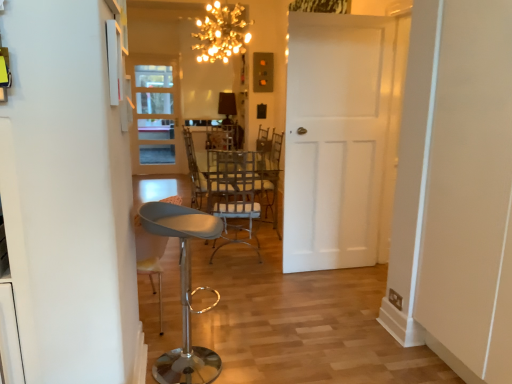
Question: Would you consider metallic gray stool at lower left to be distant from metallic silver chair at center?

Choices:
 (A) no
 (B) yes

Answer: (B)

Question: Is metallic gray stool at lower left outside metallic silver chair at center?

Choices:
 (A) no
 (B) yes

Answer: (B)

Question: Does metallic gray stool at lower left have a larger size compared to metallic silver chair at center?

Choices:
 (A) yes
 (B) no

Answer: (B)

Question: Does metallic gray stool at lower left have a greater height compared to metallic silver chair at center?

Choices:
 (A) no
 (B) yes

Answer: (A)

Question: From the image's perspective, is metallic gray stool at lower left below metallic silver chair at center?

Choices:
 (A) no
 (B) yes

Answer: (B)

Question: Is metallic silver chair at center at the back of metallic gray stool at lower left?

Choices:
 (A) yes
 (B) no

Answer: (B)

Question: Are metallic gray stool at lower left and white matte door at center, placed as the first door when sorted from right to left, making contact?

Choices:
 (A) no
 (B) yes

Answer: (A)

Question: Is metallic gray stool at lower left outside of white matte door at center, acting as the second door starting from the left?

Choices:
 (A) no
 (B) yes

Answer: (B)

Question: From a real-world perspective, is metallic gray stool at lower left positioned under white matte door at center, which appears as the 1th door when viewed from the front, based on gravity?

Choices:
 (A) yes
 (B) no

Answer: (A)

Question: Does metallic gray stool at lower left have a greater height compared to white matte door at center, the 2th door viewed from the back?

Choices:
 (A) yes
 (B) no

Answer: (B)

Question: Considering the relative sizes of metallic gray stool at lower left and white matte door at center, which appears as the 1th door when viewed from the front, in the image provided, is metallic gray stool at lower left shorter than white matte door at center, which appears as the 1th door when viewed from the front,?

Choices:
 (A) no
 (B) yes

Answer: (B)

Question: From a real-world perspective, is metallic gray stool at lower left on white matte door at center, which appears as the 1th door when viewed from the front?

Choices:
 (A) no
 (B) yes

Answer: (A)

Question: Would you say metallic silver chair at center is outside metallic gray stool at lower left?

Choices:
 (A) yes
 (B) no

Answer: (A)